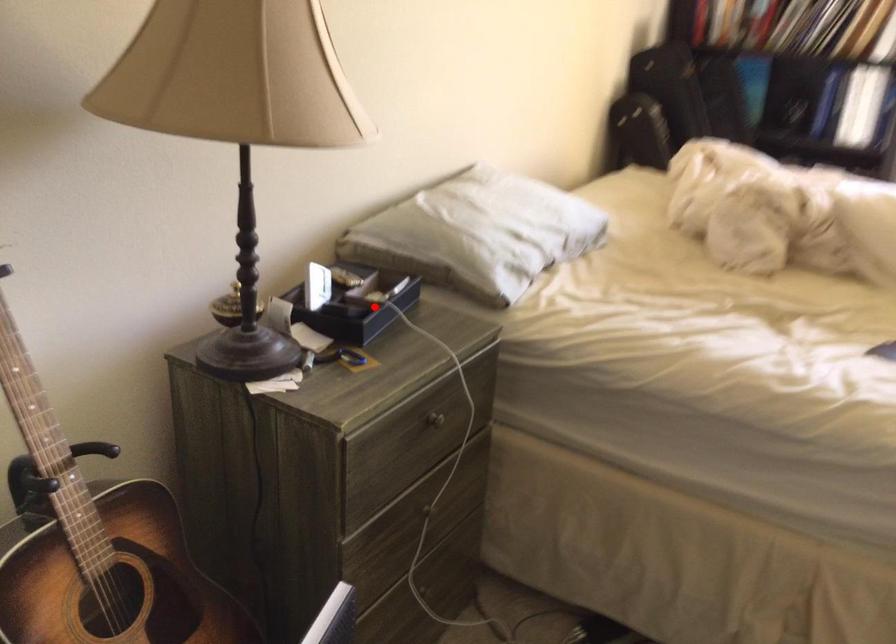
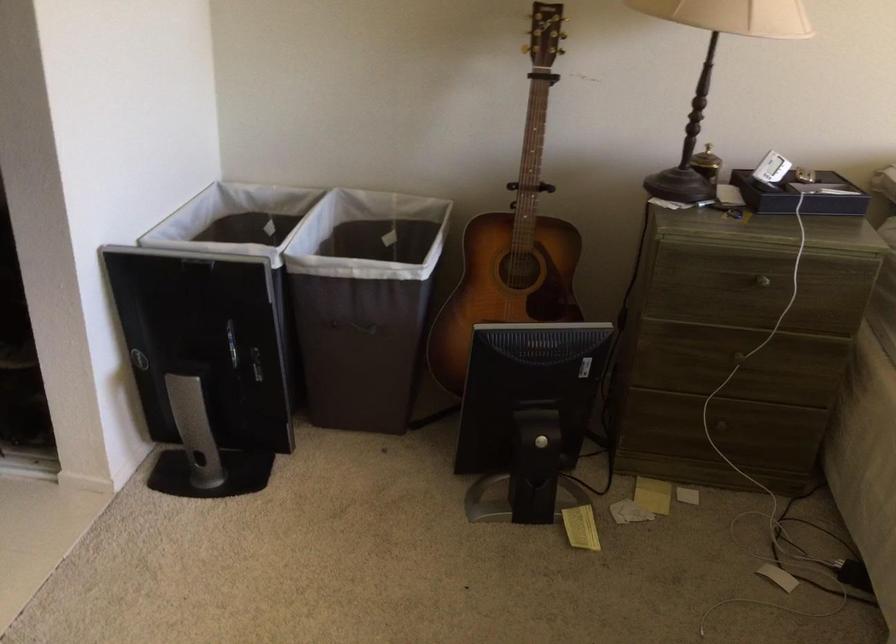
Question: I am providing you with two images of the same scene from different viewpoints. In image1, a red point is highlighted. Considering the same 3D point in image2, which of the following is correct?

Choices:
 (A) It is closer
 (B) It is farther

Answer: (B)